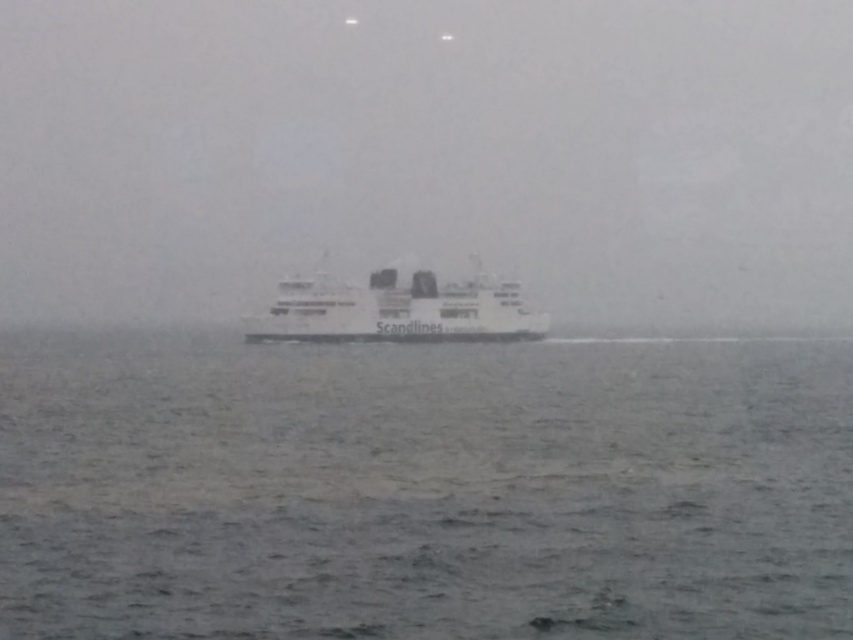
How distant is white matte fog at center from white matte ferry at center?

They are 72.55 meters apart.

Does white matte fog at center lie behind white matte ferry at center?

Yes, white matte fog at center is behind white matte ferry at center.

Does point (389, 56) come behind point (515, 301)?

Yes.

Where is `white matte fog at center`? white matte fog at center is located at coordinates tap(428, 154).

The height and width of the screenshot is (640, 853). What are the coordinates of `white matte fog at center` in the screenshot? It's located at (428, 154).

Is point (654, 164) farther from viewer compared to point (520, 483)?

Yes, point (654, 164) is farther from viewer.

The width and height of the screenshot is (853, 640). What do you see at coordinates (428, 154) in the screenshot? I see `white matte fog at center` at bounding box center [428, 154].

Where is `white matte fog at center`? The image size is (853, 640). white matte fog at center is located at coordinates (428, 154).

Looking at this image, which is above, gray matte water at center or white matte ferry at center?

white matte ferry at center

Is the position of gray matte water at center less distant than that of white matte ferry at center?

That is True.

Who is more distant from viewer, (683, 584) or (480, 333)?

The point (480, 333) is more distant.

At what (x,y) coordinates should I click in order to perform the action: click on gray matte water at center. Please return your answer as a coordinate pair (x, y). Looking at the image, I should click on (426, 490).